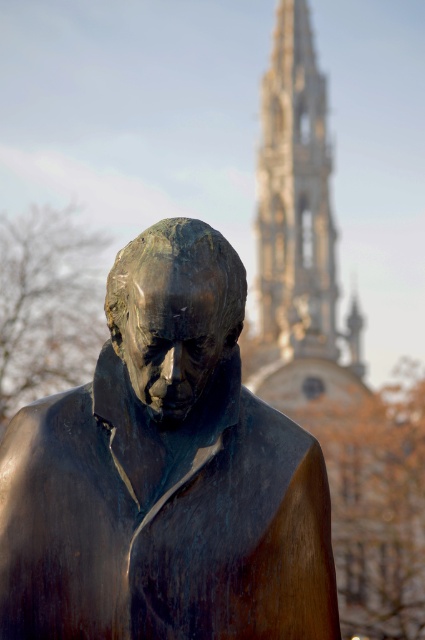
Based on the photo, you are an architect visiting the site and want to compare the height of the bronze statue at center and the white stone tower at upper center. Based on the scene, which one is taller?

The white stone tower at upper center is taller than the bronze statue at center.

You are an art student analyzing the composition of the image. Which object is located to the left of the other between the bronze statue at center and the white stone tower at upper center?

The bronze statue at center is positioned on the left side of the white stone tower at upper center.